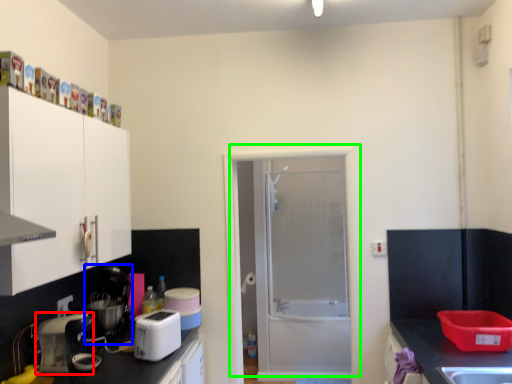
Question: Estimate the real-world distances between objects in this image. Which object is closer to kitchen appliance (highlighted by a red box), appliance (highlighted by a blue box) or door (highlighted by a green box)?

Choices:
 (A) appliance
 (B) door

Answer: (A)